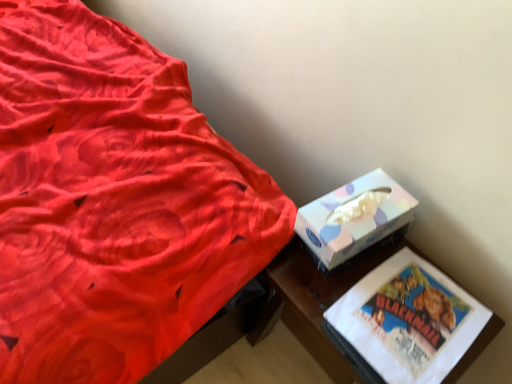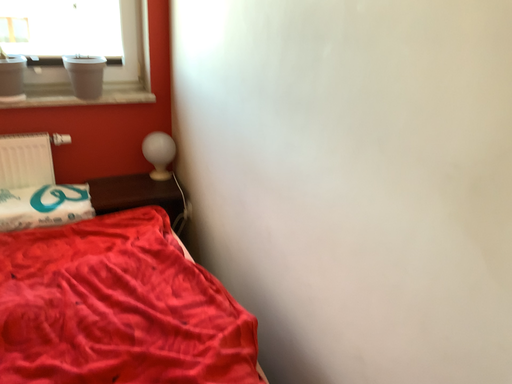
Question: Which way did the camera rotate in the video?

Choices:
 (A) rotated downward
 (B) rotated upward

Answer: (B)